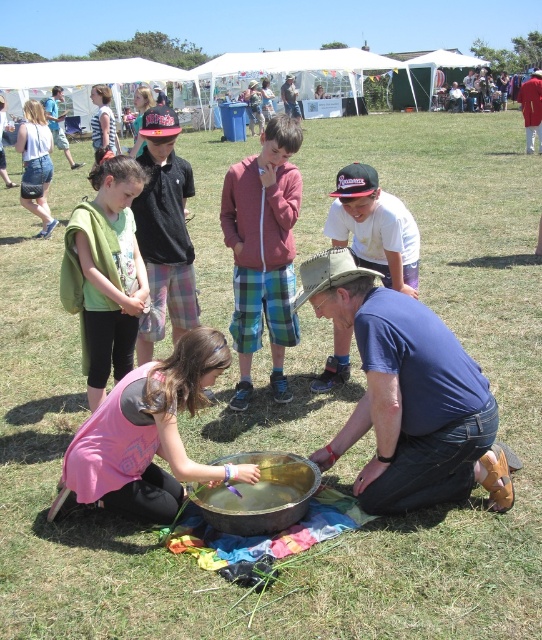
Can you confirm if blue cotton shirt at center is taller than green fleece jacket at center?

No.

Between point (358, 314) and point (72, 300), which one is positioned in front?

Point (358, 314) is more forward.

This screenshot has height=640, width=542. Find the location of `blue cotton shirt at center`. blue cotton shirt at center is located at coordinates (408, 396).

Where is `blue cotton shirt at center`? This screenshot has width=542, height=640. blue cotton shirt at center is located at coordinates (408, 396).

How distant is blue cotton shirt at center from denim jacket at center?

blue cotton shirt at center and denim jacket at center are 105.15 feet apart from each other.

Find the location of a particular element. This screenshot has height=640, width=542. blue cotton shirt at center is located at coordinates 408,396.

Image resolution: width=542 pixels, height=640 pixels. Describe the element at coordinates (532, 109) in the screenshot. I see `red fabric shirt at upper right` at that location.

Who is more forward, (526, 148) or (286, 99)?

Point (526, 148) is in front.

You are a GUI agent. You are given a task and a screenshot of the screen. Output one action in this format:
    pyautogui.click(x=<x>, y=<y>)
    Task: Click on the red fabric shirt at upper right
    Image resolution: width=542 pixels, height=640 pixels.
    Given the screenshot: What is the action you would take?
    pyautogui.click(x=532, y=109)